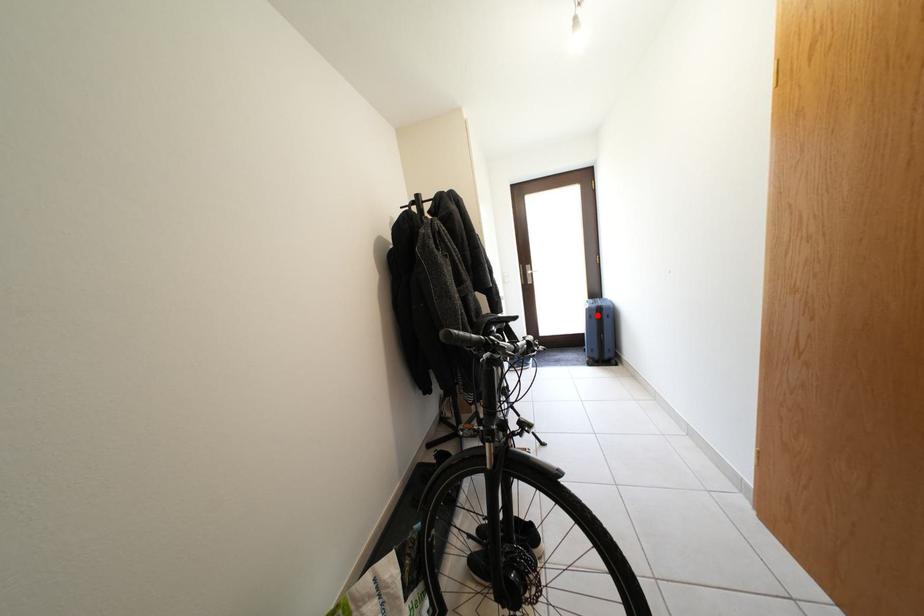
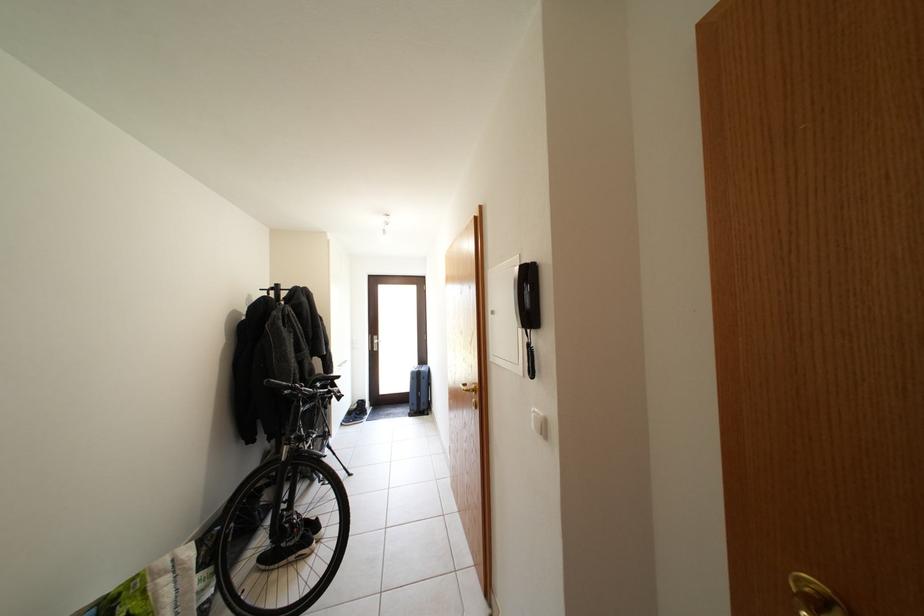
Where in the second image is the point corresponding to the highlighted location from the first image?

(420, 379)